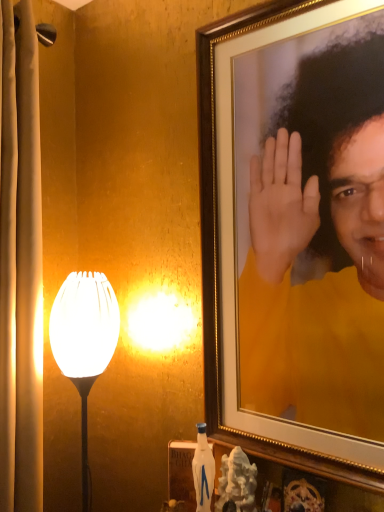
This screenshot has height=512, width=384. What do you see at coordinates (84, 341) in the screenshot?
I see `white glossy lampshade at left` at bounding box center [84, 341].

In order to face white glossy lampshade at left, should I rotate leftwards or rightwards?

Turn left by 12.955 degrees to look at white glossy lampshade at left.

Find the location of a particular element. This screenshot has width=384, height=512. white glossy lampshade at left is located at coordinates [84, 341].

This screenshot has height=512, width=384. Identify the location of matte yellow shirt at upper right. (319, 248).

Describe the element at coordinates (319, 248) in the screenshot. I see `matte yellow shirt at upper right` at that location.

Find the location of a particular element. The width and height of the screenshot is (384, 512). white glossy lampshade at left is located at coordinates (84, 341).

Which is more to the right, matte yellow shirt at upper right or white glossy lampshade at left?

From the viewer's perspective, matte yellow shirt at upper right appears more on the right side.

Is matte yellow shirt at upper right positioned before white glossy lampshade at left?

Yes, matte yellow shirt at upper right is closer to the viewer.

Does point (316, 409) come in front of point (76, 276)?

Yes.

From the image's perspective, which is below, matte yellow shirt at upper right or white glossy lampshade at left?

white glossy lampshade at left appears lower in the image.

From a real-world perspective, which object stands above the other?

From a 3D spatial view, matte yellow shirt at upper right is above.

Considering the sizes of objects matte yellow shirt at upper right and white glossy lampshade at left in the image provided, who is wider, matte yellow shirt at upper right or white glossy lampshade at left?

white glossy lampshade at left is wider.

Which of these two, matte yellow shirt at upper right or white glossy lampshade at left, stands shorter?

white glossy lampshade at left is shorter.

Is matte yellow shirt at upper right smaller than white glossy lampshade at left?

Incorrect, matte yellow shirt at upper right is not smaller in size than white glossy lampshade at left.

Is matte yellow shirt at upper right located outside white glossy lampshade at left?

Absolutely, matte yellow shirt at upper right is external to white glossy lampshade at left.

Is matte yellow shirt at upper right in contact with white glossy lampshade at left?

No, matte yellow shirt at upper right is not beside white glossy lampshade at left.

Is matte yellow shirt at upper right facing away from white glossy lampshade at left?

That's not correct — matte yellow shirt at upper right is not looking away from white glossy lampshade at left.

What's the angular difference between matte yellow shirt at upper right and white glossy lampshade at left's facing directions?

The angular difference between matte yellow shirt at upper right and white glossy lampshade at left is 39.5 degrees.

How far apart are matte yellow shirt at upper right and white glossy lampshade at left?

The distance of matte yellow shirt at upper right from white glossy lampshade at left is 54.74 centimeters.

Image resolution: width=384 pixels, height=512 pixels. I want to click on lamp below the matte yellow shirt at upper right (from a real-world perspective), so click(84, 341).

Consider the image. Is white glossy lampshade at left to the left of matte yellow shirt at upper right from the viewer's perspective?

Correct, you'll find white glossy lampshade at left to the left of matte yellow shirt at upper right.

Which object is further away from the camera, white glossy lampshade at left or matte yellow shirt at upper right?

white glossy lampshade at left is further away from the camera.

Considering the positions of point (66, 351) and point (325, 78), is point (66, 351) closer or farther from the camera than point (325, 78)?

Point (66, 351) is positioned farther from the camera compared to point (325, 78).

From the image's perspective, between white glossy lampshade at left and matte yellow shirt at upper right, who is located below?

white glossy lampshade at left, from the image's perspective.

From a real-world perspective, relative to matte yellow shirt at upper right, is white glossy lampshade at left vertically above or below?

From a real-world perspective, white glossy lampshade at left is physically below matte yellow shirt at upper right.

Considering the sizes of objects white glossy lampshade at left and matte yellow shirt at upper right in the image provided, who is wider, white glossy lampshade at left or matte yellow shirt at upper right?

With larger width is white glossy lampshade at left.

Who is shorter, white glossy lampshade at left or matte yellow shirt at upper right?

With less height is white glossy lampshade at left.

Can you confirm if white glossy lampshade at left is bigger than matte yellow shirt at upper right?

Incorrect, white glossy lampshade at left is not larger than matte yellow shirt at upper right.

Is white glossy lampshade at left spatially inside matte yellow shirt at upper right, or outside of it?

white glossy lampshade at left lies outside matte yellow shirt at upper right.

Is white glossy lampshade at left positioned far away from matte yellow shirt at upper right?

white glossy lampshade at left is actually quite close to matte yellow shirt at upper right.

Could you tell me if white glossy lampshade at left is facing matte yellow shirt at upper right?

No, white glossy lampshade at left does not turn towards matte yellow shirt at upper right.

What's the angular difference between white glossy lampshade at left and matte yellow shirt at upper right's facing directions?

There is a 39.5-degree angle between the facing directions of white glossy lampshade at left and matte yellow shirt at upper right.

This screenshot has width=384, height=512. Identify the location of lamp below the matte yellow shirt at upper right (from the image's perspective). (84, 341).

I want to click on person above the white glossy lampshade at left (from a real-world perspective), so pyautogui.click(x=319, y=248).

At what (x,y) coordinates should I click in order to perform the action: click on lamp below the matte yellow shirt at upper right (from a real-world perspective). Please return your answer as a coordinate pair (x, y). Looking at the image, I should click on (84, 341).